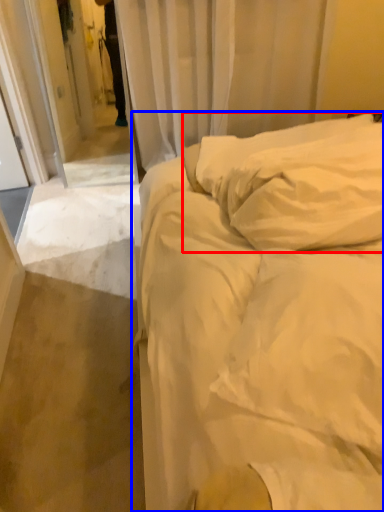
Question: Which of the following is the closest to the observer, pillow (highlighted by a red box) or bed (highlighted by a blue box)?

Choices:
 (A) pillow
 (B) bed

Answer: (B)